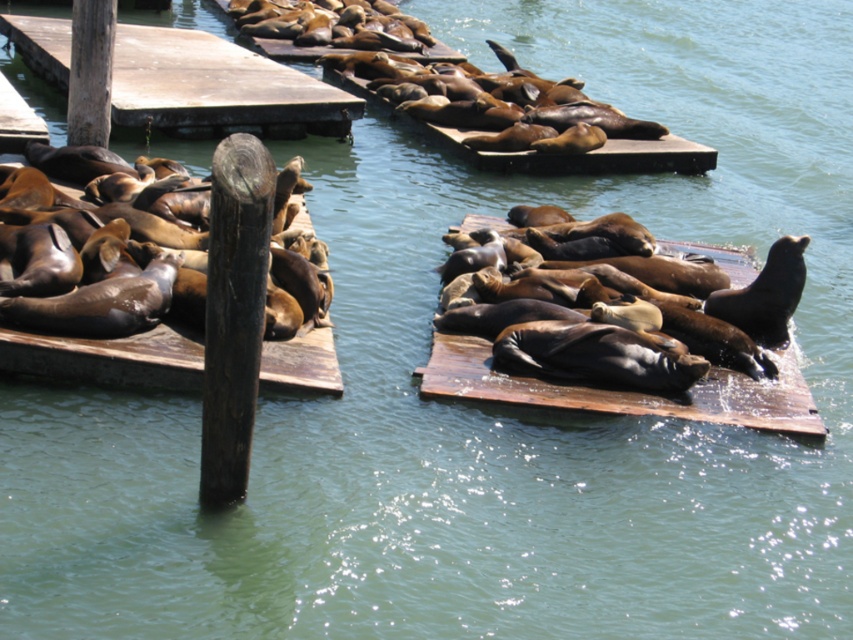
Who is more forward, (117, 120) or (711, 394)?

Point (711, 394)

Is point (57, 64) less distant than point (767, 404)?

That is False.

Who is more forward, (300,125) or (793,372)?

Point (793,372) is in front.

I want to click on wooden dock at upper left, so click(218, 88).

Which is more to the left, wooden dock at upper left or brown wooden dock at left?

From the viewer's perspective, wooden dock at upper left appears more on the left side.

Between point (306, 113) and point (105, 349), which one is positioned behind?

The point (306, 113) is more distant.

Does point (135, 108) come farther from viewer compared to point (20, 339)?

Yes, point (135, 108) is farther from viewer.

The width and height of the screenshot is (853, 640). What are the coordinates of `wooden dock at upper left` in the screenshot? It's located at (218, 88).

Between brown wooden dock at center and brown wooden dock at left, which one appears on the left side from the viewer's perspective?

brown wooden dock at left

Does brown wooden dock at center appear on the right side of brown wooden dock at left?

Yes, brown wooden dock at center is to the right of brown wooden dock at left.

Who is more distant from viewer, [793,362] or [195,365]?

The point [793,362] is behind.

At what (x,y) coordinates should I click in order to perform the action: click on brown wooden dock at center. Please return your answer as a coordinate pair (x, y). Looking at the image, I should click on (625, 390).